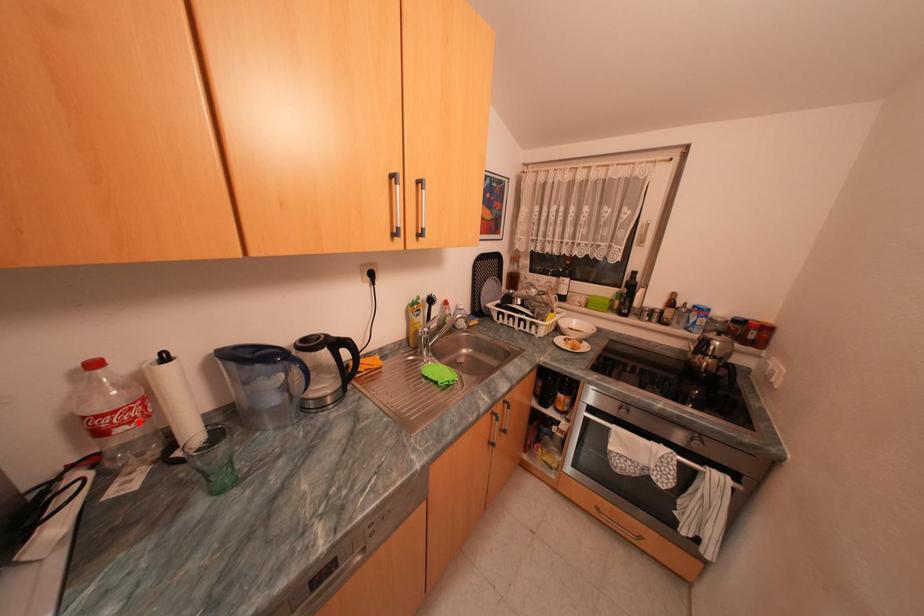
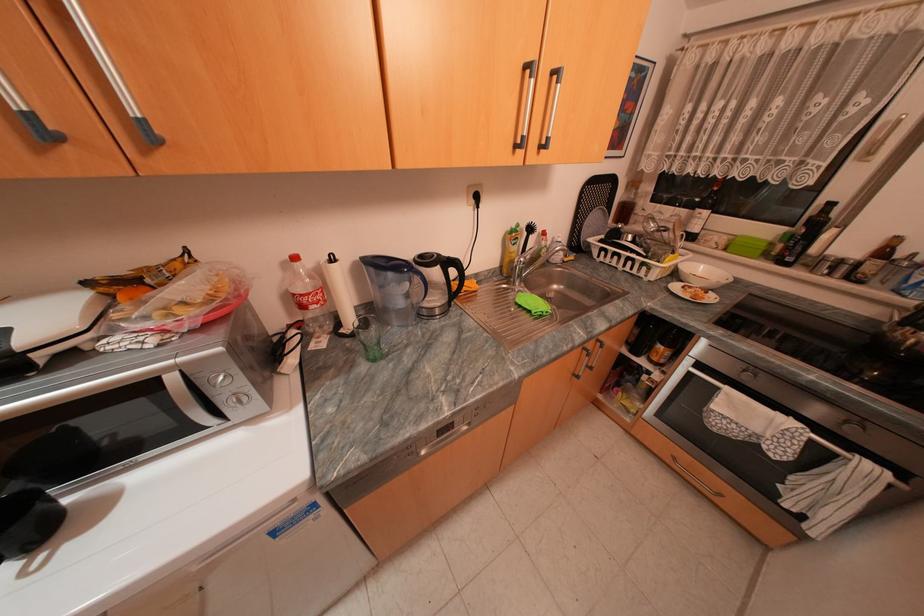
Where in the second image is the point corresponding to the highlighted location from the first image?

(326, 302)